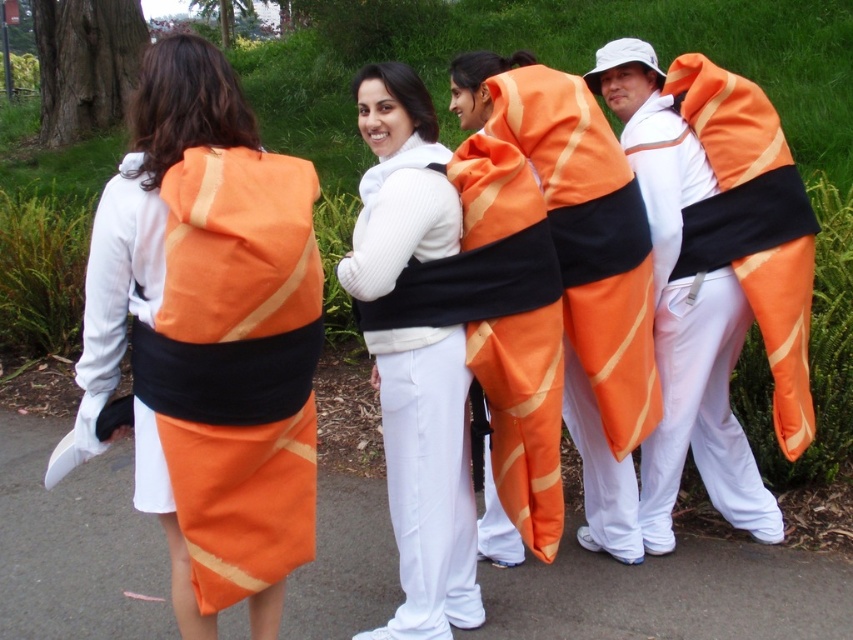
You are standing at the origin point in the park where the four sushi roll costumed people are. You see two points marked as point 1 at coordinates point [281,324] and point 2 at coordinates point [486,536]. If you want to walk towards point 2, will you pass by point 1 first?

Point 1 at coordinates point [281,324] is in front of point 2 at coordinates point [486,536], so yes, you will pass by point 1 first before reaching point 2.

You are standing in the park and see the matte orange fabric sushi roll at back. What are the coordinates of its position?

The matte orange fabric sushi roll at back is located at coordinates point [212,333].